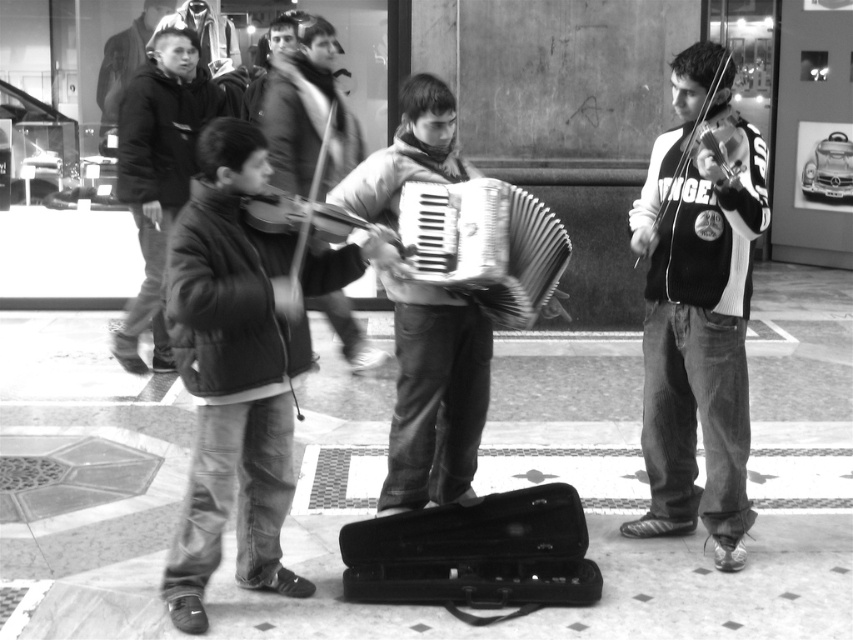
Question: Does dark fabric jacket at left lie in front of shiny black violin at right?

Choices:
 (A) no
 (B) yes

Answer: (A)

Question: Which object is farther from the camera taking this photo?

Choices:
 (A) dark fabric jacket at left
 (B) metallic silver accordion at center

Answer: (A)

Question: Based on their relative distances, which object is farther from the metallic silver accordion at center?

Choices:
 (A) white sweater at right
 (B) shiny black violin at right

Answer: (B)

Question: Which of the following is the closest to the observer?

Choices:
 (A) (711, 524)
 (B) (431, 275)
 (C) (111, 344)
 (D) (686, 67)

Answer: (B)

Question: Considering the relative positions of white sweater at right and metallic silver accordion at center in the image provided, where is white sweater at right located with respect to metallic silver accordion at center?

Choices:
 (A) right
 (B) left

Answer: (A)

Question: In this image, where is dark fabric jacket at left located relative to shiny black violin at right?

Choices:
 (A) right
 (B) left

Answer: (B)